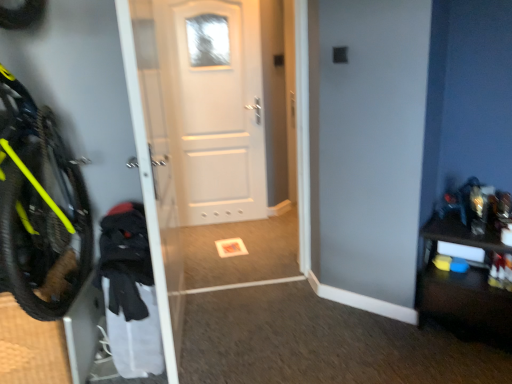
The height and width of the screenshot is (384, 512). Describe the element at coordinates (214, 107) in the screenshot. I see `white matte door at center` at that location.

What is the approximate height of white matte door at center?

The height of white matte door at center is 5.62 feet.

Measure the distance between point (263, 204) and camera.

The distance of point (263, 204) from camera is 3.91 meters.

In order to click on white matte door at center in this screenshot , I will do `click(214, 107)`.

Image resolution: width=512 pixels, height=384 pixels. I want to click on dark wood dresser at right, so click(463, 285).

The image size is (512, 384). What do you see at coordinates (463, 285) in the screenshot?
I see `dark wood dresser at right` at bounding box center [463, 285].

The height and width of the screenshot is (384, 512). In order to click on white matte door at center in this screenshot , I will do `click(214, 107)`.

Which object is positioned more to the left, dark wood dresser at right or white matte door at center?

white matte door at center.

Is dark wood dresser at right closer to camera compared to white matte door at center?

Yes, dark wood dresser at right is in front of white matte door at center.

In the scene shown: Which point is more distant from viewer, (431, 285) or (249, 70)?

Positioned behind is point (249, 70).

From the image's perspective, is dark wood dresser at right positioned above or below white matte door at center?

Based on their image positions, dark wood dresser at right is located beneath white matte door at center.

From a real-world perspective, is dark wood dresser at right located higher than white matte door at center?

No, from a real-world perspective, dark wood dresser at right is not above white matte door at center.

In terms of width, does dark wood dresser at right look wider or thinner when compared to white matte door at center?

Considering their sizes, dark wood dresser at right looks broader than white matte door at center.

Who is shorter, dark wood dresser at right or white matte door at center?

Standing shorter between the two is dark wood dresser at right.

Consider the image. Which of these two, dark wood dresser at right or white matte door at center, is smaller?

dark wood dresser at right.

Would you say dark wood dresser at right is outside white matte door at center?

Absolutely, dark wood dresser at right is external to white matte door at center.

Are dark wood dresser at right and white matte door at center located far from each other?

Indeed, dark wood dresser at right is not near white matte door at center.

Is dark wood dresser at right aimed at white matte door at center?

No.

How different are the orientations of dark wood dresser at right and white matte door at center in degrees?

The facing directions of dark wood dresser at right and white matte door at center are 45.1 degrees apart.

Where is `door located on the left of dark wood dresser at right`? The image size is (512, 384). door located on the left of dark wood dresser at right is located at coordinates (214, 107).

Considering the positions of objects white matte door at center and dark wood dresser at right in the image provided, who is more to the right, white matte door at center or dark wood dresser at right?

From the viewer's perspective, dark wood dresser at right appears more on the right side.

Is white matte door at center further to camera compared to dark wood dresser at right?

Yes, it is.

Is point (189, 84) positioned in front of point (461, 296)?

That is False.

From the image's perspective, between white matte door at center and dark wood dresser at right, which one is located above?

white matte door at center is shown above in the image.

From a real-world perspective, which object stands above the other?

white matte door at center, from a real-world perspective.

Based on the photo, between white matte door at center and dark wood dresser at right, which one has larger width?

Wider between the two is dark wood dresser at right.

Considering the sizes of objects white matte door at center and dark wood dresser at right in the image provided, who is taller, white matte door at center or dark wood dresser at right?

Standing taller between the two is white matte door at center.

Can you confirm if white matte door at center is bigger than dark wood dresser at right?

Yes.

Based on the photo, could dark wood dresser at right be considered to be inside white matte door at center?

Definitely not — dark wood dresser at right is not inside white matte door at center.

Looking at this image, are white matte door at center and dark wood dresser at right located far from each other?

Yes, white matte door at center and dark wood dresser at right are located far from each other.

Could you tell me if white matte door at center is turned towards dark wood dresser at right?

No, white matte door at center is not facing towards dark wood dresser at right.

This screenshot has height=384, width=512. In order to click on dresser below the white matte door at center (from the image's perspective) in this screenshot , I will do 463,285.

What are the coordinates of `dresser that appears below the white matte door at center (from the image's perspective)` in the screenshot? It's located at (463, 285).

You are a GUI agent. You are given a task and a screenshot of the screen. Output one action in this format:
    pyautogui.click(x=<x>, y=<y>)
    Task: Click on the door above the dark wood dresser at right (from a real-world perspective)
    Image resolution: width=512 pixels, height=384 pixels.
    Given the screenshot: What is the action you would take?
    214,107